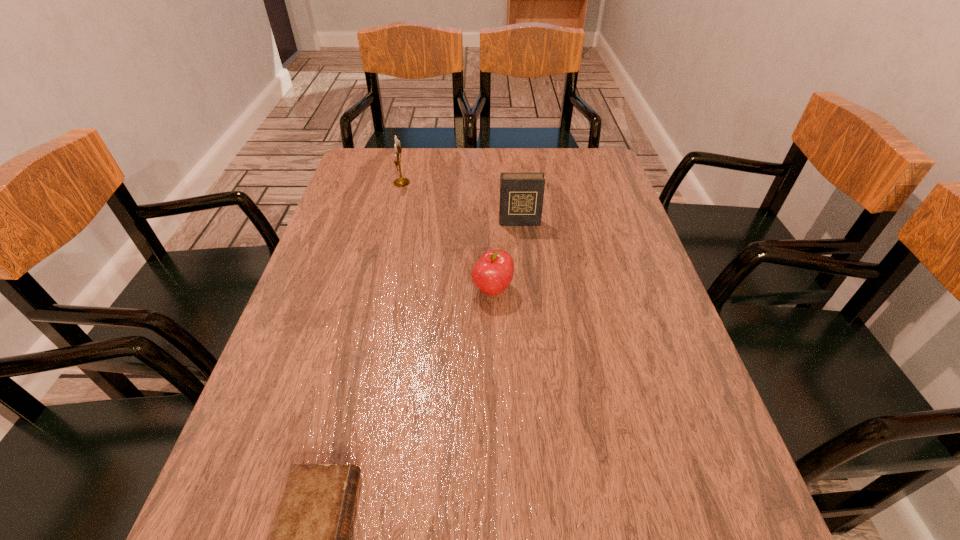
At what (x,y) coordinates should I click in order to perform the action: click on object that is at the far left corner. Please return your answer as a coordinate pair (x, y). Looking at the image, I should click on pyautogui.click(x=400, y=182).

Where is `free spot at the far edge of the desktop`? free spot at the far edge of the desktop is located at coordinates (488, 153).

Locate an element on the screen. vacant space at the left edge of the desktop is located at coordinates [x=288, y=339].

This screenshot has height=540, width=960. What are the coordinates of `vacant space at the right edge of the desktop` in the screenshot? It's located at (612, 286).

Identify the location of free space at the far left corner of the desktop. This screenshot has width=960, height=540. (377, 184).

I want to click on vacant space at the far right corner of the desktop, so click(x=573, y=160).

Where is `unoccupied position between the candelabrum and the third nearest object`? Image resolution: width=960 pixels, height=540 pixels. unoccupied position between the candelabrum and the third nearest object is located at coordinates (461, 202).

The width and height of the screenshot is (960, 540). Identify the location of vacant space that's between the farthest object and the taller diary. (461, 202).

Identify which object is the second closest to the farthest object. Please provide its 2D coordinates. Your answer should be formatted as a tuple, i.e. [(x, y)], where the tuple contains the x and y coordinates of a point satisfying the conditions above.

[(493, 272)]

Locate an element on the screen. This screenshot has width=960, height=540. object that can be found as the second closest to the apple is located at coordinates (309, 539).